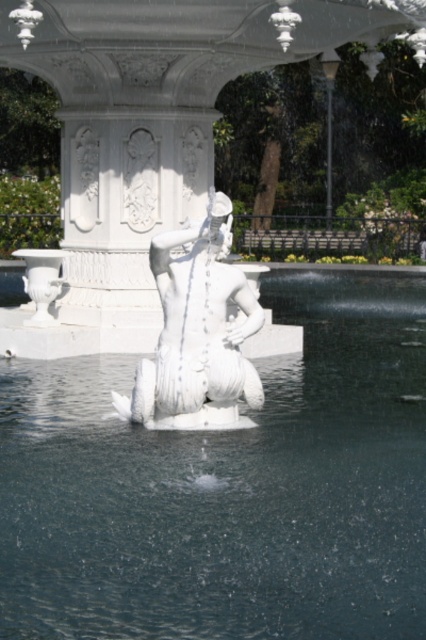
You are standing in the park and want to take a photo of the clear water at statue center. Where should you position yourself to capture it in the frame?

To capture the clear water at statue center in your photo, position yourself so that the camera is aimed at the coordinates point (229, 486).

You are a park visitor standing in front of the fountain. You see the clear water at statue center and the white marble statue at center. Which object is positioned lower in the scene?

The clear water at statue center is positioned lower than the white marble statue at center.